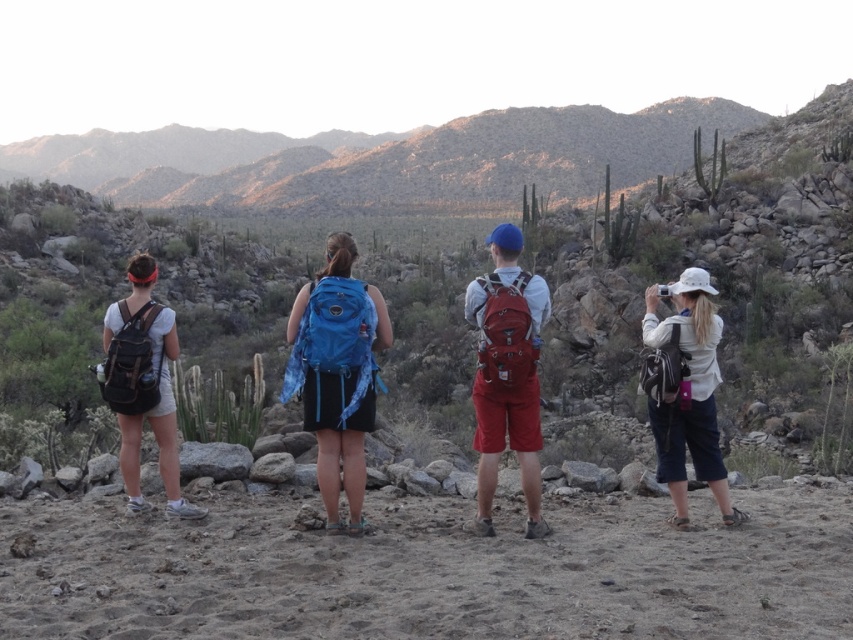
You are a photographer planning to take a group photo of the four individuals in the desert scene. You want to ensure that both the white matte hat at right and the matte black backpack at left are visible in the frame. Based on their positions, which object should you focus on first to include both in the photo?

The white matte hat at right is located below the matte black backpack at left, so focusing on the matte black backpack at left first will ensure both objects are included in the frame since the hat is positioned lower.

You are planning to take a photo of the scene. You have a camera that can only focus on objects wider than 20 cm. Based on the image, will the white matte hat at right and the matte black backpack at left both be in focus?

The white matte hat at right is thinner than the matte black backpack at left. Since the camera requires objects wider than 20 cm to focus, the matte black backpack at left is likely wider than 20 cm and will be in focus. However, the white matte hat at right being thinner might be narrower than 20 cm, so it may not be in focus.